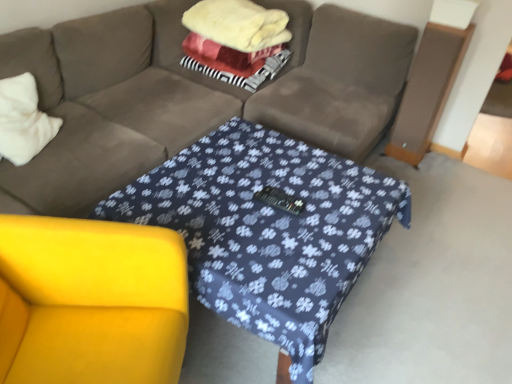
Question: Can you confirm if fluffy white blanket at center is thinner than white soft pillow at left?

Choices:
 (A) no
 (B) yes

Answer: (A)

Question: From a real-world perspective, is fluffy white blanket at center physically above white soft pillow at left?

Choices:
 (A) no
 (B) yes

Answer: (B)

Question: Considering the relative positions of fluffy white blanket at center and white soft pillow at left in the image provided, is fluffy white blanket at center in front of white soft pillow at left?

Choices:
 (A) yes
 (B) no

Answer: (B)

Question: Does fluffy white blanket at center lie behind white soft pillow at left?

Choices:
 (A) no
 (B) yes

Answer: (B)

Question: From a real-world perspective, is fluffy white blanket at center located beneath white soft pillow at left?

Choices:
 (A) yes
 (B) no

Answer: (B)

Question: Is white soft pillow at left completely or partially inside fluffy white blanket at center?

Choices:
 (A) yes
 (B) no

Answer: (B)

Question: Is there a large distance between white soft pillow at left and yellow fabric armchair at lower left?

Choices:
 (A) yes
 (B) no

Answer: (B)

Question: Is white soft pillow at left positioned in front of yellow fabric armchair at lower left?

Choices:
 (A) yes
 (B) no

Answer: (B)

Question: Is white soft pillow at left with yellow fabric armchair at lower left?

Choices:
 (A) no
 (B) yes

Answer: (A)

Question: Does white soft pillow at left have a greater width compared to yellow fabric armchair at lower left?

Choices:
 (A) no
 (B) yes

Answer: (A)

Question: Is white soft pillow at left at the left side of yellow fabric armchair at lower left?

Choices:
 (A) no
 (B) yes

Answer: (B)

Question: From a real-world perspective, is white soft pillow at left on top of yellow fabric armchair at lower left?

Choices:
 (A) no
 (B) yes

Answer: (B)

Question: Is yellow fabric armchair at lower left far from fluffy white blanket at center?

Choices:
 (A) no
 (B) yes

Answer: (B)